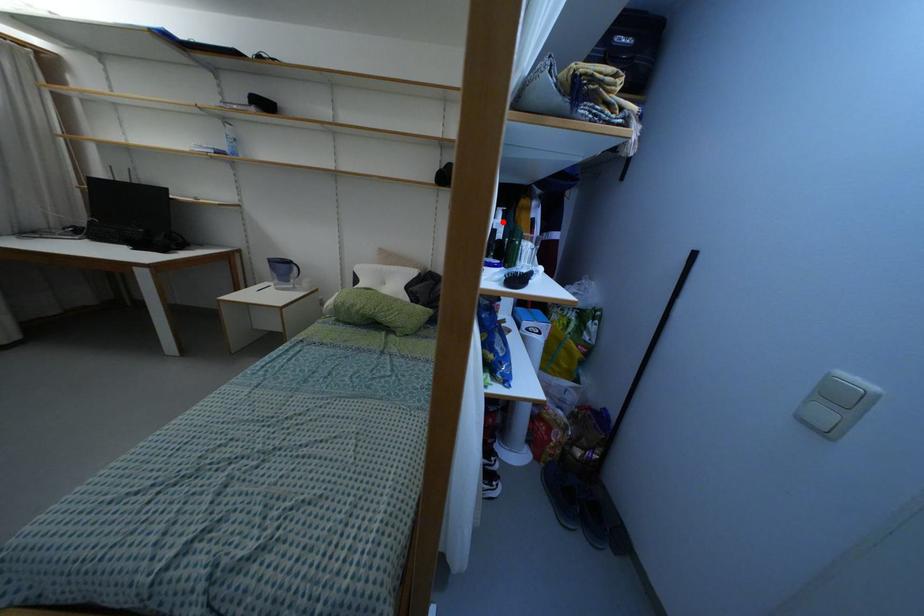
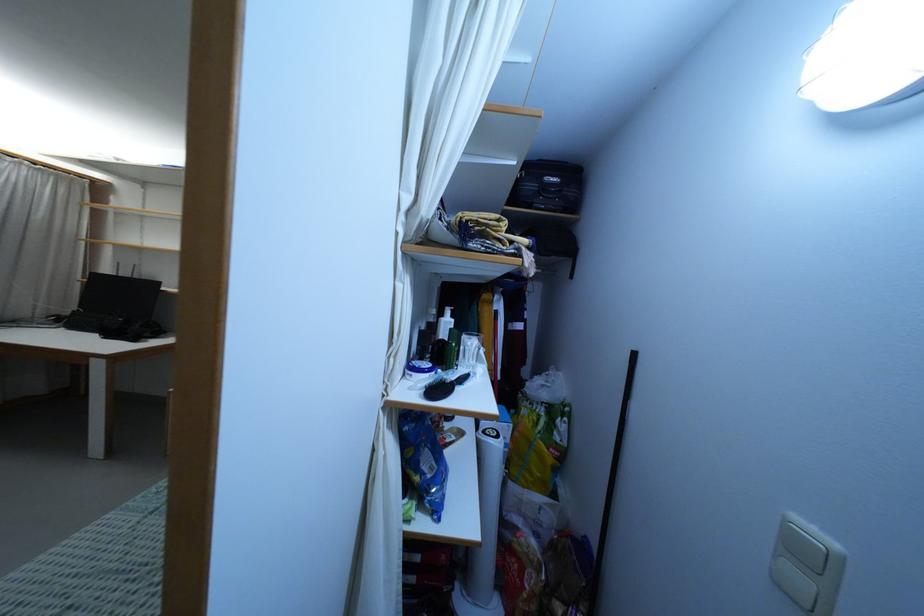
In the second image, find the point that corresponds to the highlighted location in the first image.

(453, 320)